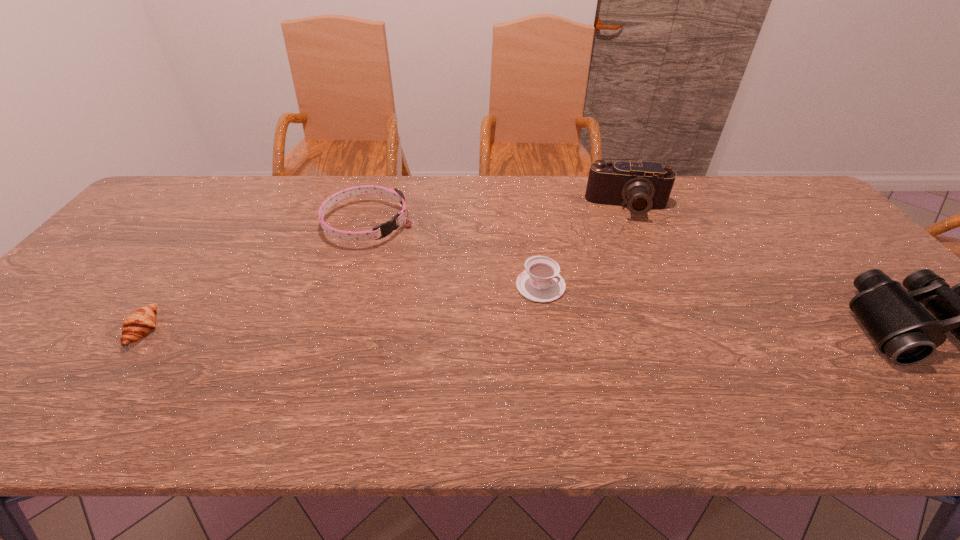
In order to click on vacant point that satisfies the following two spatial constraints: 1. on the back side of the camera; 2. on the right side of the fourth object from right to left in this screenshot , I will do `click(373, 207)`.